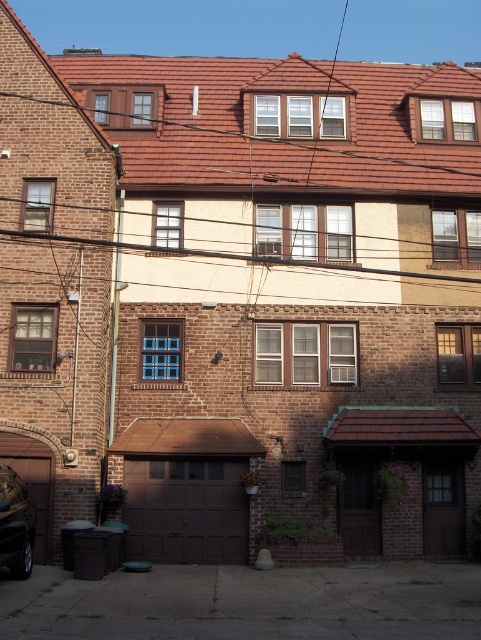
Question: Which point is closer to the camera taking this photo?

Choices:
 (A) (227, 490)
 (B) (421, 524)
 (C) (0, 515)

Answer: (C)

Question: Does brown matte garage door at lower center have a greater width compared to brown wood garage door at lower left?

Choices:
 (A) yes
 (B) no

Answer: (A)

Question: Which point is closer to the camera taking this photo?

Choices:
 (A) (216, 522)
 (B) (13, 500)

Answer: (B)

Question: Is brown matte garage door at lower center closer to the viewer compared to brown wood garage door at lower left?

Choices:
 (A) yes
 (B) no

Answer: (B)

Question: Does brown wood garage door at lower center have a smaller size compared to shiny black car at lower left?

Choices:
 (A) no
 (B) yes

Answer: (A)

Question: Which of the following is the farthest from the observer?

Choices:
 (A) brown wood garage door at lower center
 (B) shiny black car at lower left
 (C) brown wood garage door at lower left

Answer: (A)